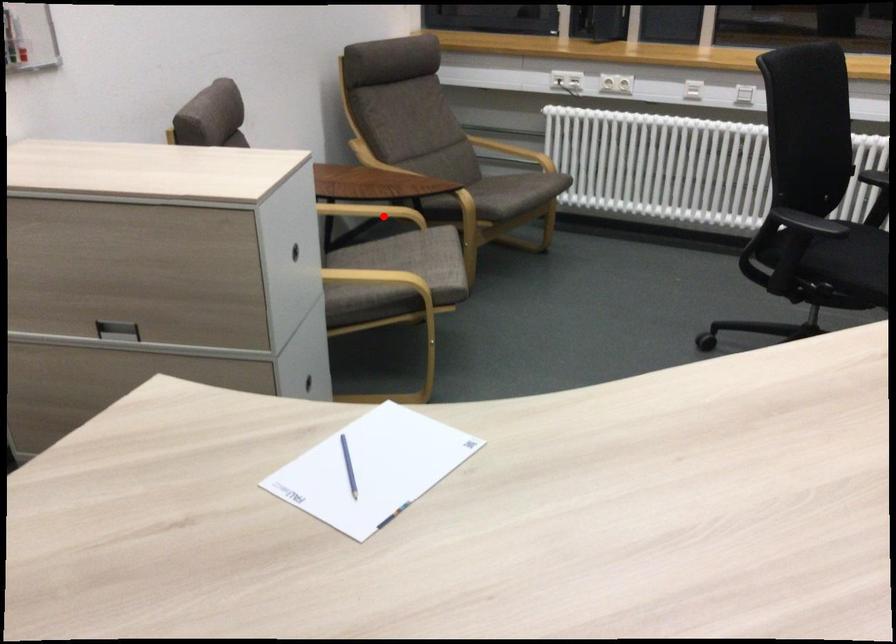
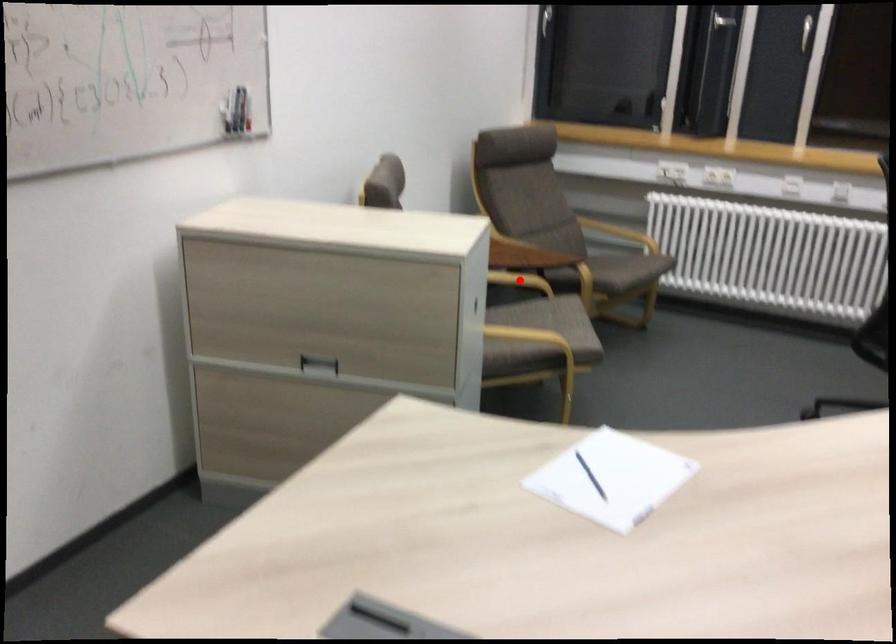
I am providing you with two images of the same scene from different viewpoints. A red point is marked on the first image and another point is marked on the second image. Do the highlighted points in image1 and image2 indicate the same real-world spot?

Yes